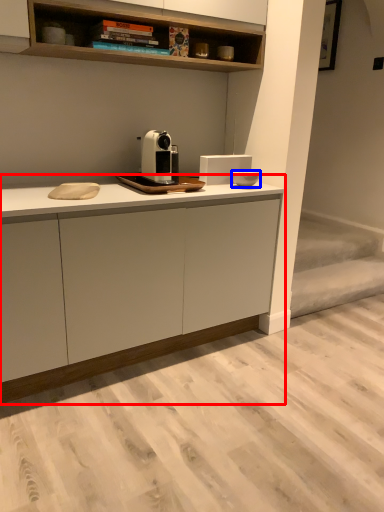
Question: Which object is further to the camera taking this photo, cabinetry (highlighted by a red box) or appliance (highlighted by a blue box)?

Choices:
 (A) cabinetry
 (B) appliance

Answer: (B)